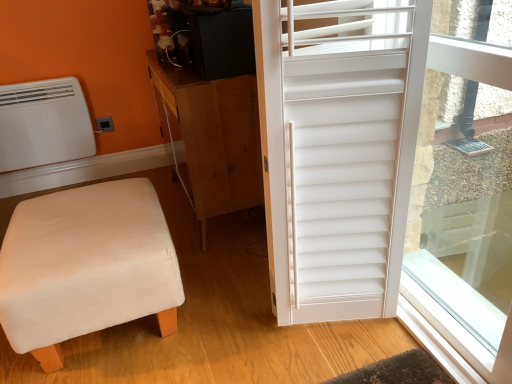
Locate an element on the screen. This screenshot has width=512, height=384. vacant space in front of white matte shutter at right is located at coordinates (350, 363).